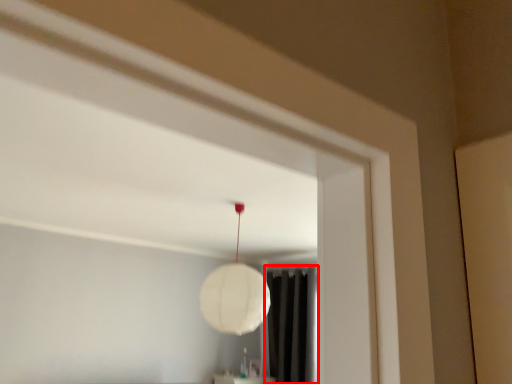
Question: From the image's perspective, what is the correct spatial positioning of curtain (annotated by the red box) in reference to lamp?

Choices:
 (A) below
 (B) above

Answer: (A)